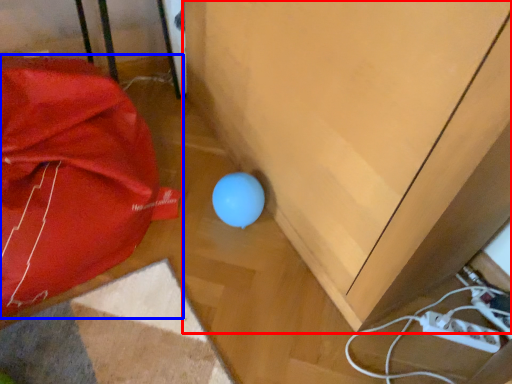
Question: Which object appears closest to the camera in this image, furniture (highlighted by a red box) or umbrella (highlighted by a blue box)?

Choices:
 (A) furniture
 (B) umbrella

Answer: (A)